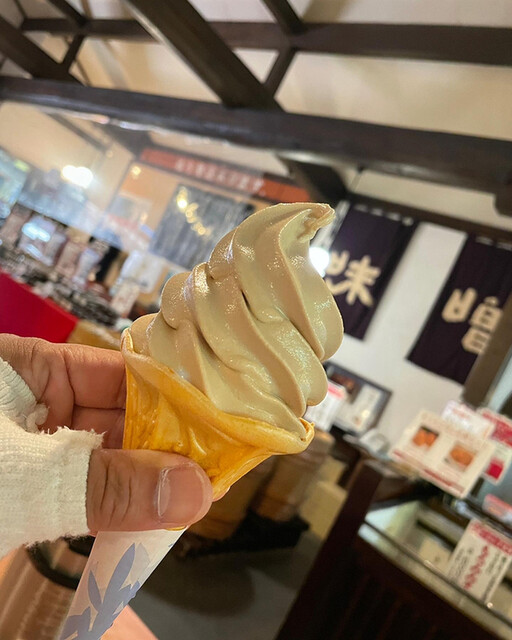
Where is `sheet`? Image resolution: width=512 pixels, height=640 pixels. sheet is located at coordinates (149, 554).